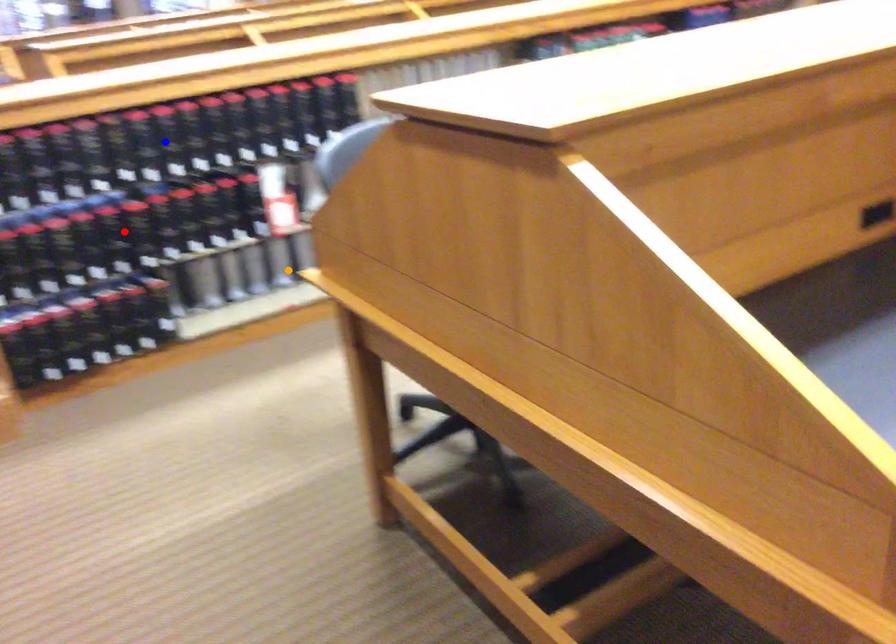
Order these from nearest to farthest:
red point | orange point | blue point

blue point
red point
orange point